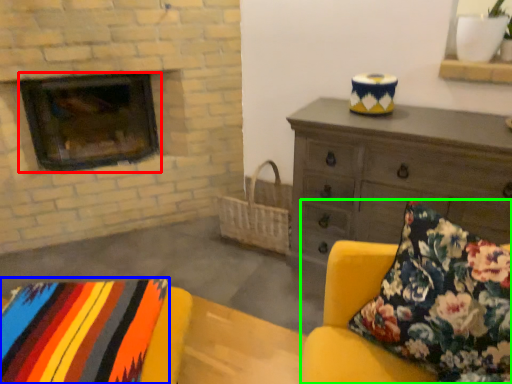
Question: Which object is the closest to the wood burning stove (highlighted by a red box)? Choose among these: blanket (highlighted by a blue box) or studio couch (highlighted by a green box).

Choices:
 (A) blanket
 (B) studio couch

Answer: (A)